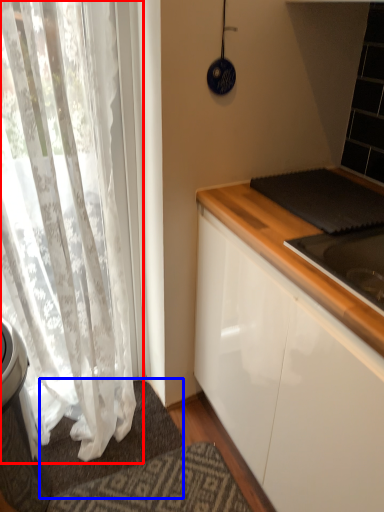
Question: Among these objects, which one is nearest to the camera, curtain (highlighted by a red box) or doormat (highlighted by a blue box)?

Choices:
 (A) curtain
 (B) doormat

Answer: (A)